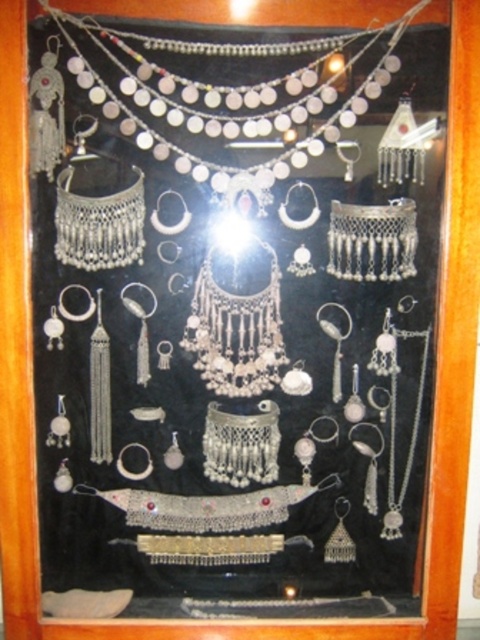
Question: Which point is farther to the camera?

Choices:
 (A) silver metallic necklace at center
 (B) silver metallic necklace at upper center

Answer: (A)

Question: Is silver metallic necklace at upper center thinner than silver metallic necklace at center?

Choices:
 (A) yes
 (B) no

Answer: (B)

Question: Which object is closer to the camera taking this photo?

Choices:
 (A) silver metallic necklace at center
 (B) silver metallic necklace at upper center

Answer: (B)

Question: Can you confirm if silver metallic necklace at upper center is positioned to the left of silver metallic necklace at center?

Choices:
 (A) yes
 (B) no

Answer: (B)

Question: Which of the following is the closest to the observer?

Choices:
 (A) (172, 92)
 (B) (220, 305)

Answer: (A)

Question: Is silver metallic necklace at upper center thinner than silver metallic necklace at center?

Choices:
 (A) no
 (B) yes

Answer: (A)